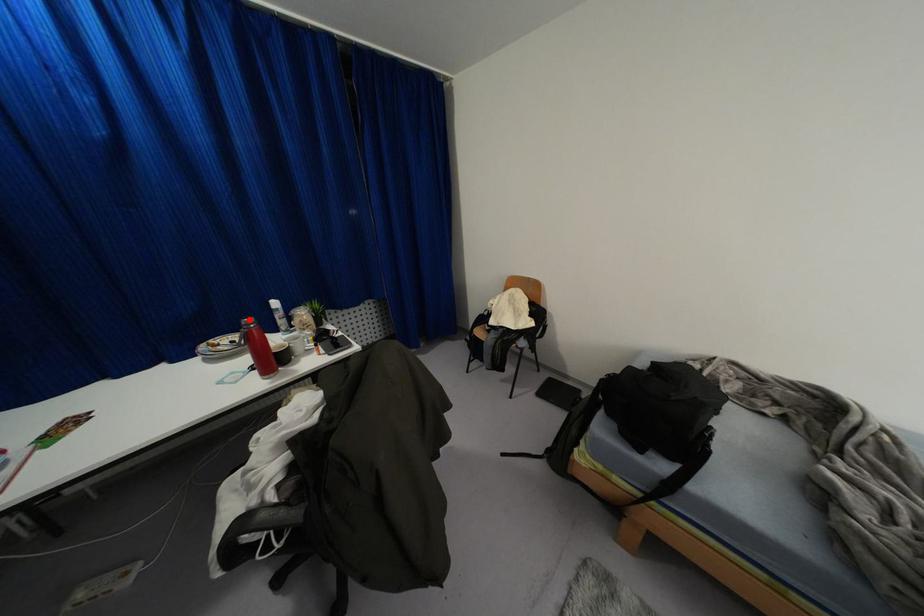
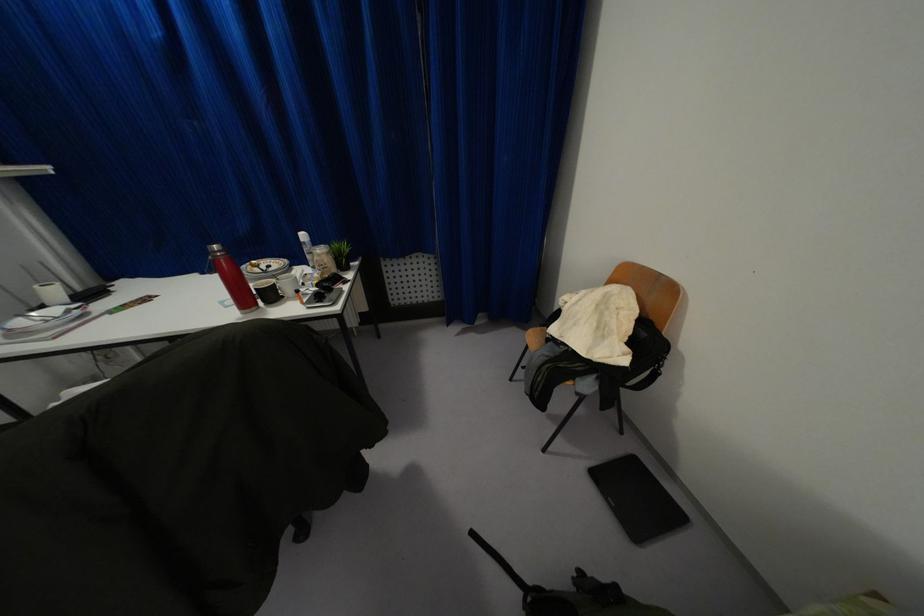
Find the pixel in the second image that matches the highlighted location in the first image.

(214, 246)